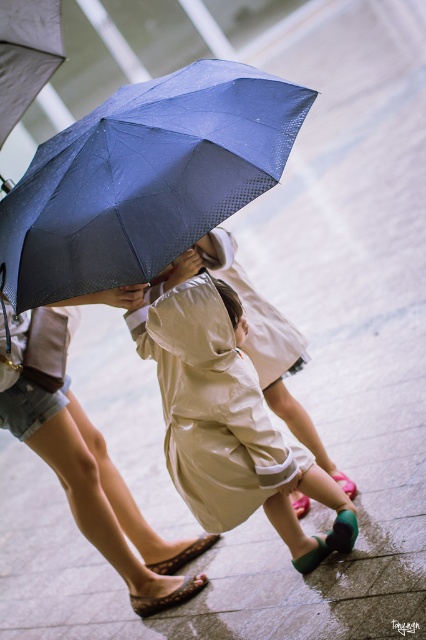
Question: Which point is closer to the camera?

Choices:
 (A) matte blue umbrella at center
 (B) beige satin raincoat at center

Answer: (A)

Question: Does matte blue umbrella at center appear over beige satin raincoat at center?

Choices:
 (A) yes
 (B) no

Answer: (A)

Question: Among these objects, which one is farthest from the camera?

Choices:
 (A) matte blue umbrella at center
 (B) beige satin raincoat at center

Answer: (B)

Question: Observing the image, what is the correct spatial positioning of matte blue umbrella at center in reference to beige satin raincoat at center?

Choices:
 (A) right
 (B) left

Answer: (B)

Question: Does matte blue umbrella at center appear on the left side of beige satin raincoat at center?

Choices:
 (A) yes
 (B) no

Answer: (A)

Question: Which point appears farthest from the camera in this image?

Choices:
 (A) (198, 164)
 (B) (215, 381)

Answer: (B)